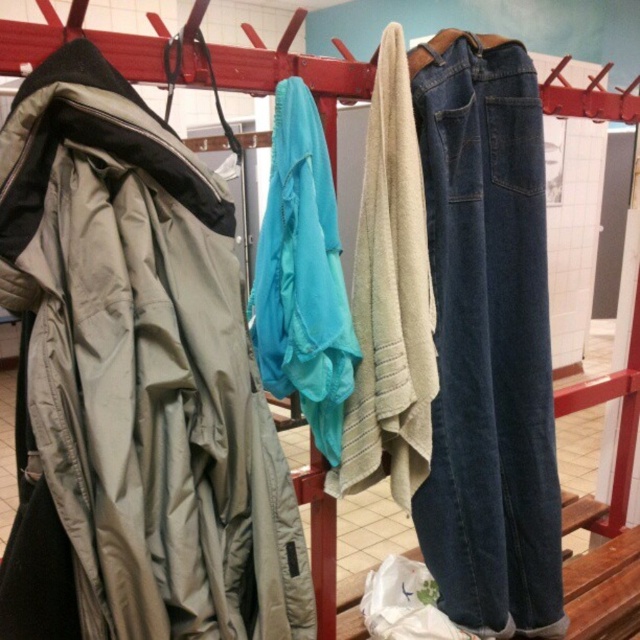
Is point (38, 364) in front of point (552, 525)?

Yes, point (38, 364) is closer to viewer.

Who is shorter, matte khaki jacket at left or denim at right?

matte khaki jacket at left

Does point (102, 547) come behind point (531, 316)?

No, it is not.

This screenshot has height=640, width=640. I want to click on matte khaki jacket at left, so click(132, 384).

Based on the photo, is denim at right to the left of matte blue towel at center from the viewer's perspective?

In fact, denim at right is to the right of matte blue towel at center.

Can you confirm if denim at right is bigger than matte blue towel at center?

Correct, denim at right is larger in size than matte blue towel at center.

Does point (525, 260) come behind point (291, 168)?

Yes, point (525, 260) is behind point (291, 168).

You are a GUI agent. You are given a task and a screenshot of the screen. Output one action in this format:
    pyautogui.click(x=<x>, y=<y>)
    Task: Click on the denim at right
    The width and height of the screenshot is (640, 640).
    Given the screenshot: What is the action you would take?
    pyautogui.click(x=486, y=340)

Between beige towel at center and matte blue towel at center, which one is positioned higher?

beige towel at center is higher up.

Does beige towel at center have a greater height compared to matte blue towel at center?

Yes, beige towel at center is taller than matte blue towel at center.

This screenshot has height=640, width=640. I want to click on beige towel at center, so [390, 300].

Where is `beige towel at center`? The height and width of the screenshot is (640, 640). beige towel at center is located at coordinates (390, 300).